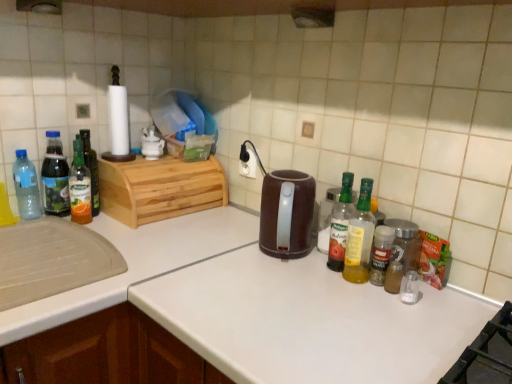
Question: Is the position of translucent glass bottle at left, marked as the 7th bottle in a right-to-left arrangement, more distant than that of clear glass spice jar at right, marked as the eighth bottle in a left-to-right arrangement?

Choices:
 (A) yes
 (B) no

Answer: (A)

Question: From a real-world perspective, is translucent glass bottle at left, marked as the 7th bottle in a right-to-left arrangement, physically below clear glass spice jar at right, positioned as the first bottle in right-to-left order?

Choices:
 (A) yes
 (B) no

Answer: (B)

Question: Considering the relative sizes of translucent glass bottle at left, marked as the 7th bottle in a right-to-left arrangement, and clear glass spice jar at right, positioned as the first bottle in right-to-left order, in the image provided, is translucent glass bottle at left, marked as the 7th bottle in a right-to-left arrangement, smaller than clear glass spice jar at right, positioned as the first bottle in right-to-left order,?

Choices:
 (A) yes
 (B) no

Answer: (B)

Question: Can you confirm if translucent glass bottle at left, marked as the 7th bottle in a right-to-left arrangement, is taller than clear glass spice jar at right, marked as the eighth bottle in a left-to-right arrangement?

Choices:
 (A) yes
 (B) no

Answer: (A)

Question: Does translucent glass bottle at left, marked as the 7th bottle in a right-to-left arrangement, touch clear glass spice jar at right, marked as the eighth bottle in a left-to-right arrangement?

Choices:
 (A) no
 (B) yes

Answer: (A)

Question: Considering the positions of point (354, 233) and point (31, 213), is point (354, 233) closer or farther from the camera than point (31, 213)?

Choices:
 (A) closer
 (B) farther

Answer: (A)

Question: From the image's perspective, is translucent plastic bottle at right, which ranks as the sixth bottle in left-to-right order, above or below transparent plastic bottle at left, the eighth bottle viewed from the right?

Choices:
 (A) below
 (B) above

Answer: (A)

Question: Is translucent plastic bottle at right, which is the third bottle in right-to-left order, to the left or to the right of transparent plastic bottle at left, which is the first bottle from left to right, in the image?

Choices:
 (A) right
 (B) left

Answer: (A)

Question: Is translucent plastic bottle at right, which is the third bottle in right-to-left order, wider or thinner than transparent plastic bottle at left, the eighth bottle viewed from the right?

Choices:
 (A) thin
 (B) wide

Answer: (A)

Question: Looking at their shapes, would you say clear glass spice jar at right, positioned as the first bottle in right-to-left order, is wider or thinner than translucent glass bottle at left, marked as the fourth bottle in a left-to-right arrangement?

Choices:
 (A) wide
 (B) thin

Answer: (B)

Question: Considering the positions of clear glass spice jar at right, positioned as the first bottle in right-to-left order, and translucent glass bottle at left, marked as the fourth bottle in a left-to-right arrangement, in the image, is clear glass spice jar at right, positioned as the first bottle in right-to-left order, bigger or smaller than translucent glass bottle at left, marked as the fourth bottle in a left-to-right arrangement,?

Choices:
 (A) small
 (B) big

Answer: (A)

Question: In the image, is clear glass spice jar at right, marked as the eighth bottle in a left-to-right arrangement, positioned in front of or behind translucent glass bottle at left, marked as the fourth bottle in a left-to-right arrangement?

Choices:
 (A) front
 (B) behind

Answer: (A)

Question: From a real-world perspective, is clear glass spice jar at right, marked as the eighth bottle in a left-to-right arrangement, positioned above or below translucent glass bottle at left, marked as the fourth bottle in a left-to-right arrangement?

Choices:
 (A) above
 (B) below

Answer: (B)

Question: From the image's perspective, relative to brown plastic kettle at center, is clear glass spice jar at right, positioned as the first bottle in right-to-left order, above or below?

Choices:
 (A) below
 (B) above

Answer: (A)

Question: Is point (415, 263) closer or farther from the camera than point (293, 238)?

Choices:
 (A) closer
 (B) farther

Answer: (A)